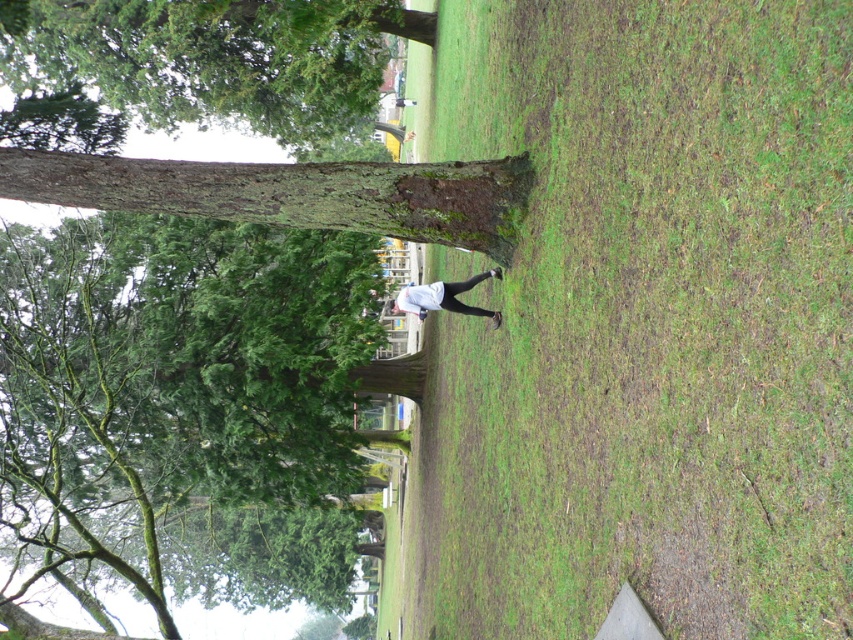
Does point (787, 340) lie in front of point (469, 282)?

Yes, it is in front of point (469, 282).

Identify the location of green grass at center. (648, 324).

Who is higher up, brown rough tree trunk at center or white matte shirt at center?

brown rough tree trunk at center

Image resolution: width=853 pixels, height=640 pixels. I want to click on brown rough tree trunk at center, so click(216, 58).

Who is more distant from viewer, (138, 106) or (425, 308)?

Point (138, 106)

Where is `brown rough tree trunk at center`? brown rough tree trunk at center is located at coordinates (216, 58).

Does green grass at center appear on the left side of brown rough tree trunk at center?

Incorrect, green grass at center is not on the left side of brown rough tree trunk at center.

At what (x,y) coordinates should I click in order to perform the action: click on green grass at center. Please return your answer as a coordinate pair (x, y). Looking at the image, I should click on [x=648, y=324].

Is point (544, 403) more distant than point (54, 173)?

No, (544, 403) is in front of (54, 173).

Locate an element on the screen. green grass at center is located at coordinates (648, 324).